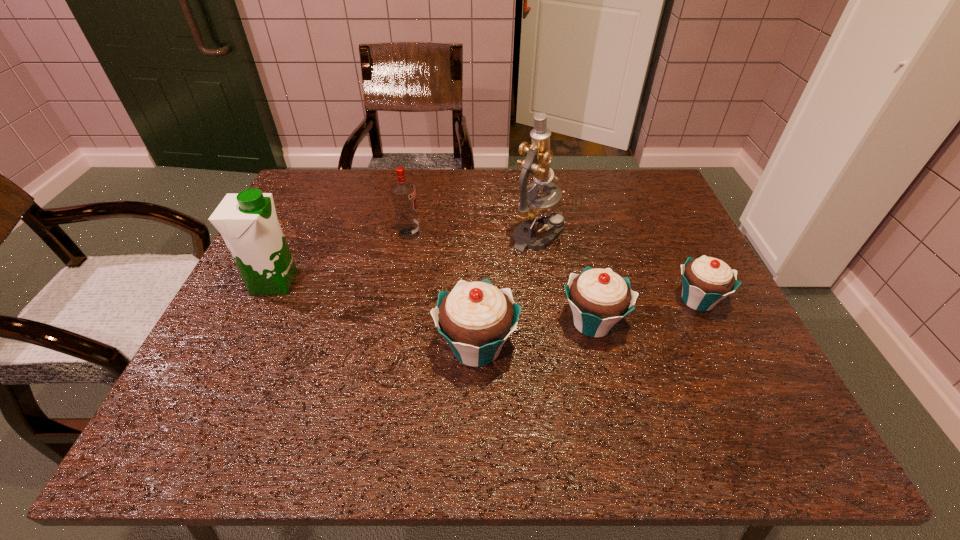
You are a GUI agent. You are given a task and a screenshot of the screen. Output one action in this format:
    pyautogui.click(x=<x>, y=<y>)
    Task: Click on the free spot located on the left of the second cupcake from left to right
    
    Given the screenshot: What is the action you would take?
    pyautogui.click(x=476, y=323)

I want to click on free spot located on the left of the rightmost object, so click(x=517, y=300).

This screenshot has width=960, height=540. I want to click on vacant space located 0.320m on the right of the microscope, so click(684, 235).

Locate an element on the screen. This screenshot has height=540, width=960. vacant space positioned 0.090m on the front label of the vodka is located at coordinates (454, 233).

Where is `free space located on the front-facing side of the second tallest object`? This screenshot has height=540, width=960. free space located on the front-facing side of the second tallest object is located at coordinates pyautogui.click(x=466, y=282).

Locate an element on the screen. object positioned at the near edge is located at coordinates (476, 318).

Where is `object at the left edge`? The image size is (960, 540). object at the left edge is located at coordinates (248, 223).

The height and width of the screenshot is (540, 960). Find the location of `object that is at the right edge`. object that is at the right edge is located at coordinates (706, 281).

In the image, there is a desktop. Where is `vacant space at the far edge`? vacant space at the far edge is located at coordinates (386, 204).

I want to click on free space at the near edge of the desktop, so click(x=459, y=388).